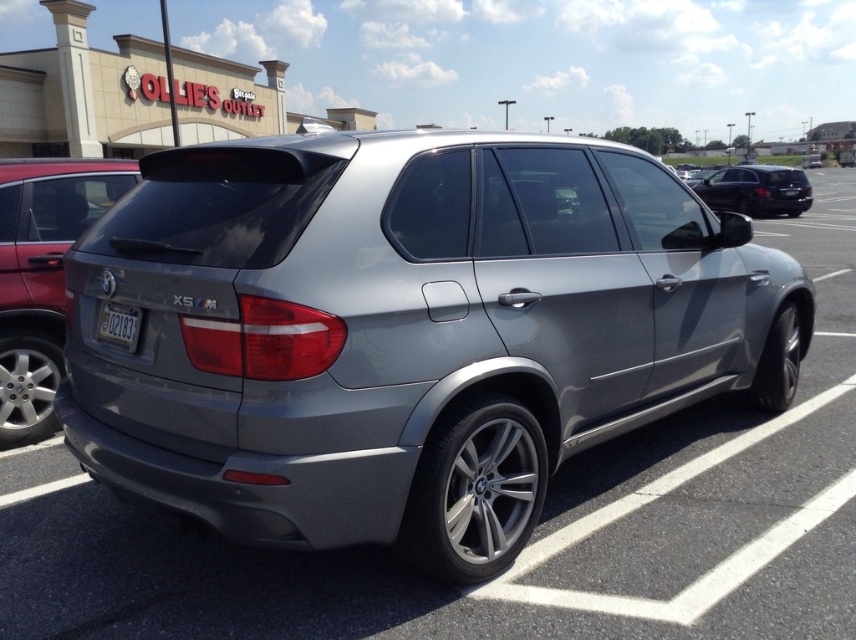
From the picture: Is satin silver minivan at rear wider than shiny black sedan at right?

Correct, the width of satin silver minivan at rear exceeds that of shiny black sedan at right.

Which is in front, point (55, 378) or point (732, 172)?

Point (55, 378) is more forward.

Image resolution: width=856 pixels, height=640 pixels. Find the location of `satin silver minivan at rear`. satin silver minivan at rear is located at coordinates (42, 276).

Which is behind, point (562, 307) or point (789, 204)?

The point (789, 204) is behind.

Who is more distant from viewer, (x=278, y=252) or (x=800, y=192)?

The point (x=800, y=192) is more distant.

Image resolution: width=856 pixels, height=640 pixels. I want to click on satin metallic suv at center, so click(407, 332).

Is point (30, 308) farther from camera compared to point (113, 339)?

Yes, it is behind point (113, 339).

Between satin silver minivan at rear and white plastic license plate at rear, which one appears on the left side from the viewer's perspective?

satin silver minivan at rear is more to the left.

Is point (34, 358) closer to camera compared to point (117, 312)?

No, it is behind (117, 312).

I want to click on satin silver minivan at rear, so pyautogui.click(x=42, y=276).